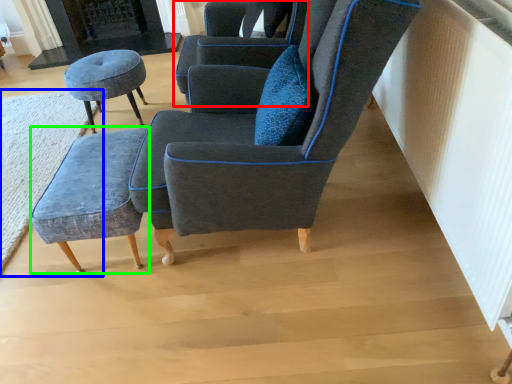
Question: Which object is the farthest from chair (highlighted by a red box)? Choose among these: mat (highlighted by a blue box) or stool (highlighted by a green box).

Choices:
 (A) mat
 (B) stool

Answer: (A)